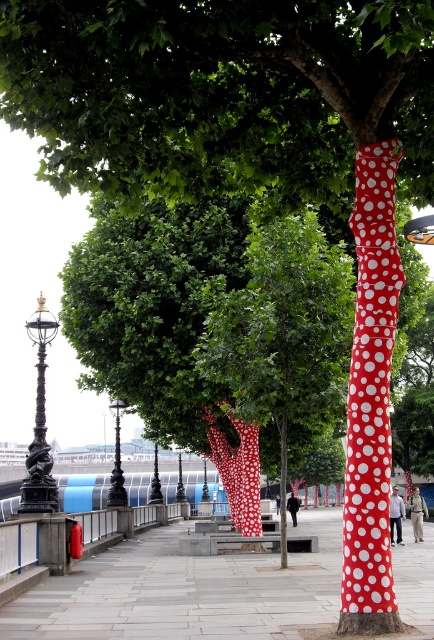
Does smooth concrete pavement at center have a larger size compared to red dotted pole at right?

Yes.

Does smooth concrete pavement at center appear over red dotted pole at right?

Incorrect, smooth concrete pavement at center is not positioned above red dotted pole at right.

Who is more forward, (x=117, y=556) or (x=358, y=390)?

Point (x=358, y=390) is in front.

You are a GUI agent. You are given a task and a screenshot of the screen. Output one action in this format:
    pyautogui.click(x=<x>, y=<y>)
    Task: Click on the smooth concrete pavement at center
    
    Given the screenshot: What is the action you would take?
    pyautogui.click(x=187, y=592)

Does red dotted pole at right appear on the left side of black polished metal pole at center?

In fact, red dotted pole at right is to the right of black polished metal pole at center.

Which is more to the right, red dotted pole at right or black polished metal pole at center?

From the viewer's perspective, red dotted pole at right appears more on the right side.

Which is in front, point (368, 291) or point (151, 502)?

Point (368, 291)

At what (x,y) coordinates should I click in order to perform the action: click on red dotted pole at right. Please return your answer as a coordinate pair (x, y). Looking at the image, I should click on (371, 400).

Is red dotted fabric at center to the right of red dotted pole at right from the viewer's perspective?

In fact, red dotted fabric at center is to the left of red dotted pole at right.

Who is lower down, red dotted fabric at center or red dotted pole at right?

red dotted fabric at center is below.

Who is more forward, (345, 376) or (361, 499)?

Positioned in front is point (361, 499).

This screenshot has width=434, height=640. I want to click on red dotted fabric at center, so click(283, 332).